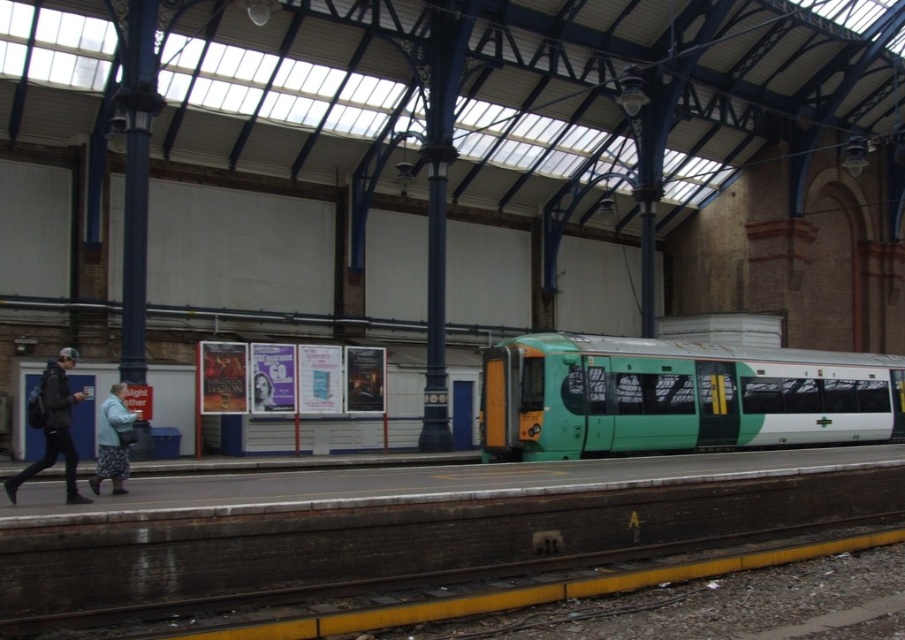
From the picture: You are a traveler standing on the train station platform. You see a dark blue jacket at left and a fluffy gray coat at lower left. Which item is located more to the left side of the platform?

The dark blue jacket at left is positioned on the left side of the fluffy gray coat at lower left, so it is more to the left side of the platform.

You are a passenger waiting at the train station platform. You notice the green matte train at center and the fluffy gray coat at lower left. Which object takes up more visual space in the scene?

The green matte train at center is bigger than the fluffy gray coat at lower left, so it takes up more visual space in the scene.